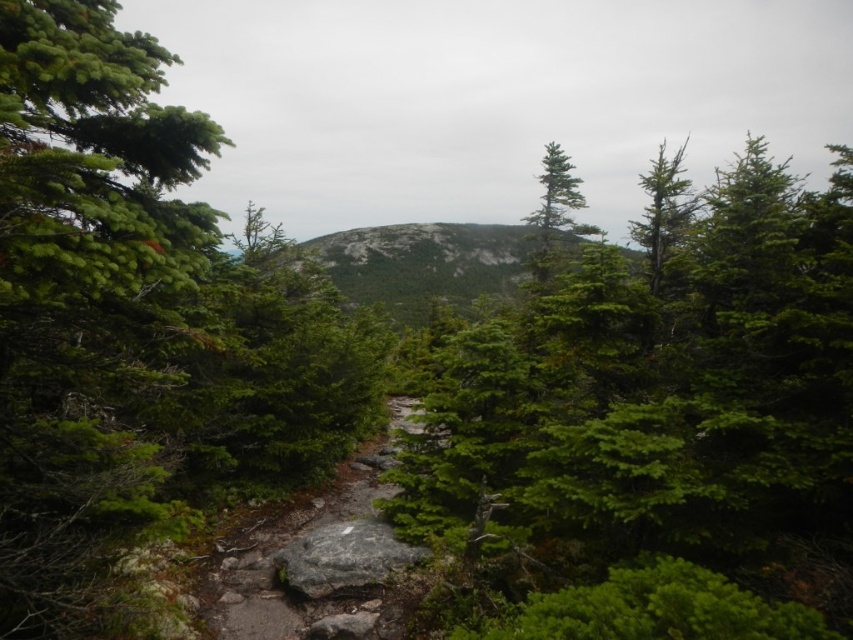
You are a hiker walking along the path in the forest scene. You notice two rocks ahead of you on the path. The first is a green textured rock at center, and the second is a gray rough rock at center. Which rock will you encounter first as you continue walking forward?

The green textured rock at center will be encountered first since the gray rough rock at center is positioned behind it along the path.

You are a hiker standing at the starting point of the path. You notice a green needle like object at point (126, 317). Which direction should you move to reach it?

The green needle like object at point (126, 317) is located to the left of your current position, so you should move to the left to reach it.

You are a hiker walking along the path in the forest scene. You notice two rocks in the center of the path. Which rock is positioned to the right of the other? The options are the green textured rock at center and the gray rough rock at center.

The green textured rock at center is positioned to the right of the gray rough rock at center.